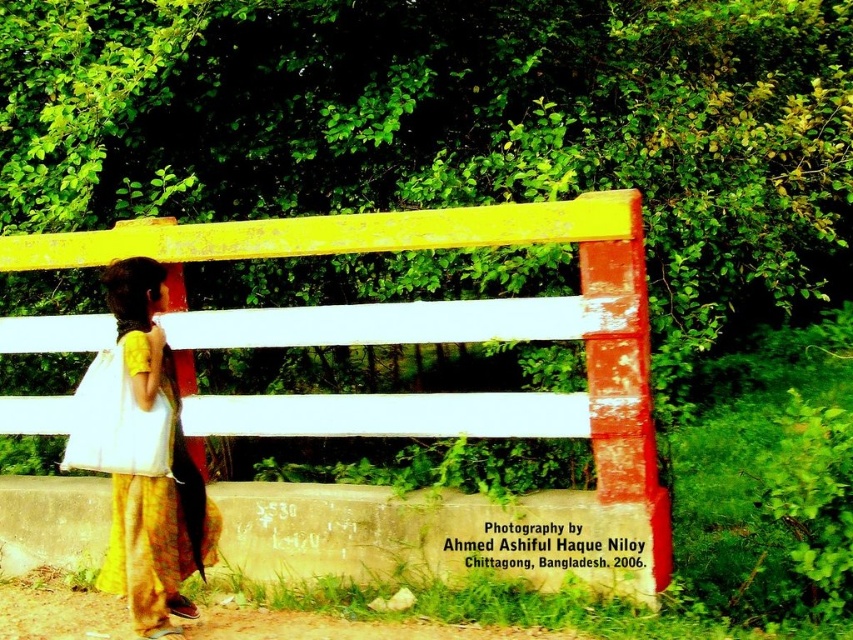
Is yellow painted wood fence at center positioned in front of yellow cotton dress at left?

No, yellow painted wood fence at center is behind yellow cotton dress at left.

Does yellow painted wood fence at center have a lesser height compared to yellow cotton dress at left?

No, yellow painted wood fence at center is not shorter than yellow cotton dress at left.

What do you see at coordinates (428, 394) in the screenshot?
I see `yellow painted wood fence at center` at bounding box center [428, 394].

Locate an element on the screen. This screenshot has width=853, height=640. yellow painted wood fence at center is located at coordinates (428, 394).